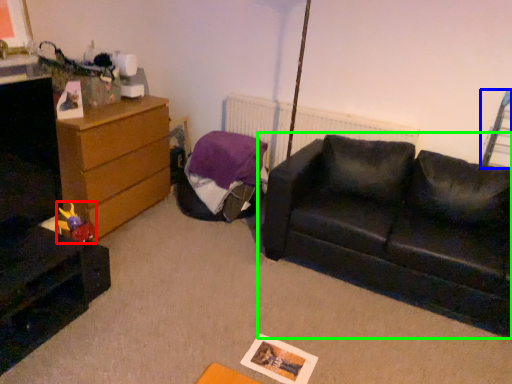
Question: Which object is positioned closest to toy (highlighted by a red box)? Select from swivel chair (highlighted by a blue box) and studio couch (highlighted by a green box).

Choices:
 (A) swivel chair
 (B) studio couch

Answer: (B)